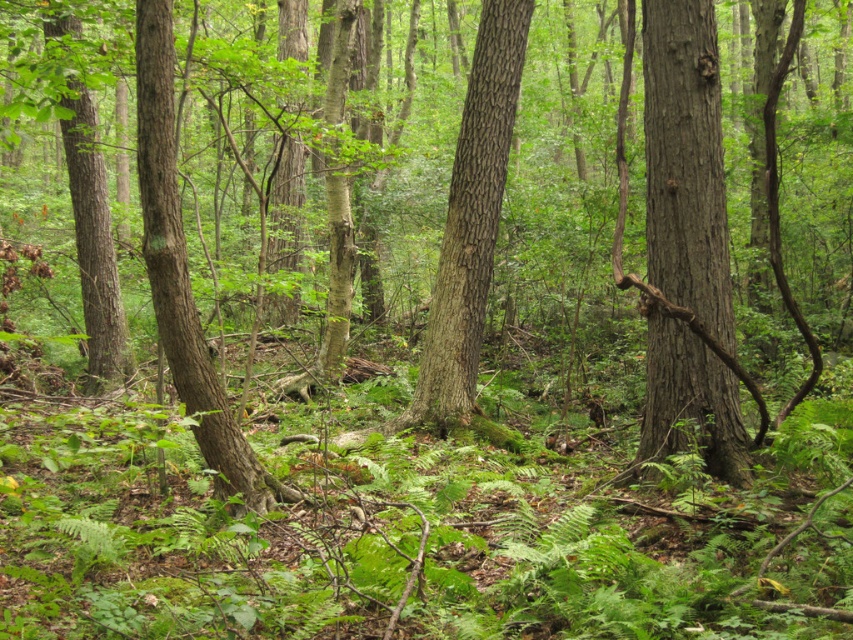
You are navigating through the forest and see the smooth brown tree trunk at center and the rough bark tree at left. Which tree is positioned more to the left side of the scene?

The rough bark tree at left is positioned more to the left side of the scene compared to the smooth brown tree trunk at center.

You are navigating through a dense forest and come across a point marked at coordinates [469,221]. Based on the scene description, what type of tree is located at this point?

The point at [469,221] corresponds to a smooth bark tree at center.

You are an environmental scientist studying tree growth patterns in this forest. You observe the smooth brown tree trunk at center and the rough bark tree at left. Which tree is shorter?

The smooth brown tree trunk at center is shorter than the rough bark tree at left.